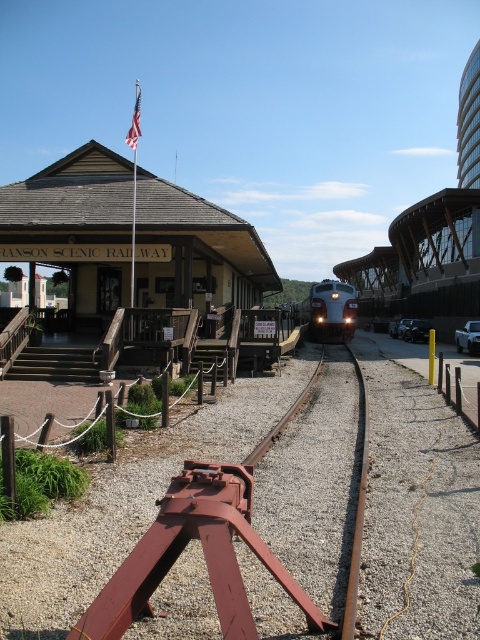
Which of these two, brown wooden railway station at left or metallic silver pickup truck at center, stands shorter?

metallic silver pickup truck at center

Does brown wooden railway station at left have a lesser width compared to metallic silver pickup truck at center?

In fact, brown wooden railway station at left might be wider than metallic silver pickup truck at center.

Is point (194, 282) closer to viewer compared to point (474, 332)?

Yes, it is in front of point (474, 332).

I want to click on brown wooden railway station at left, so click(x=74, y=225).

Consider the image. Does brown wooden railway station at left appear under silver metallic train at center?

Indeed, brown wooden railway station at left is positioned under silver metallic train at center.

Between brown wooden railway station at left and silver metallic train at center, which one appears on the left side from the viewer's perspective?

brown wooden railway station at left

I want to click on brown wooden railway station at left, so click(74, 225).

This screenshot has height=640, width=480. In order to click on brown wooden railway station at left in this screenshot , I will do `click(74, 225)`.

Is brown wooden railway station at left to the left of blue polished metal train at center from the viewer's perspective?

Indeed, brown wooden railway station at left is positioned on the left side of blue polished metal train at center.

In the scene shown: Is brown wooden railway station at left below blue polished metal train at center?

Actually, brown wooden railway station at left is above blue polished metal train at center.

This screenshot has height=640, width=480. What do you see at coordinates (74, 225) in the screenshot? I see `brown wooden railway station at left` at bounding box center [74, 225].

At what (x,y) coordinates should I click in order to perform the action: click on brown wooden railway station at left. Please return your answer as a coordinate pair (x, y). Looking at the image, I should click on (74, 225).